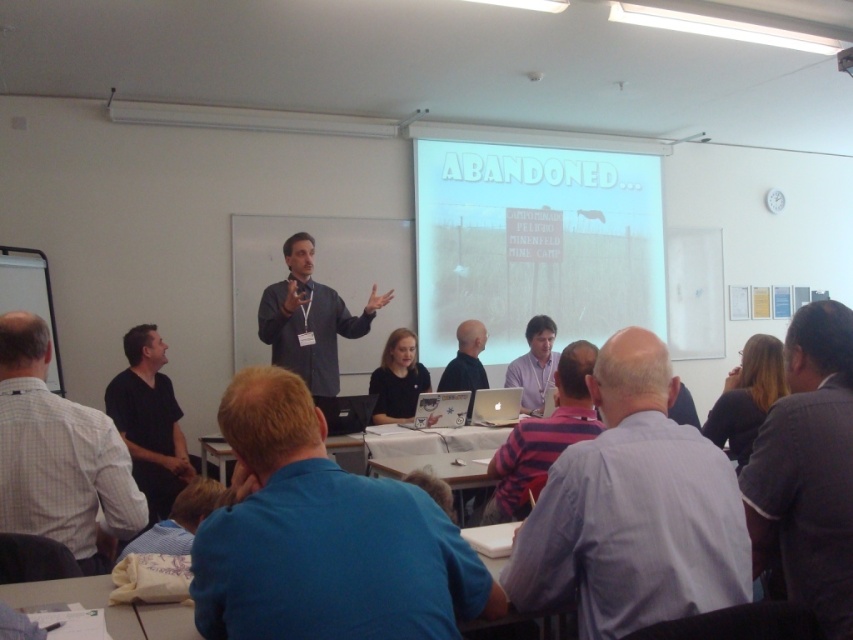
Is gray striped shirt at center to the right of dark gray suit at right from the viewer's perspective?

In fact, gray striped shirt at center is to the left of dark gray suit at right.

Does gray striped shirt at center come behind dark gray suit at right?

That is False.

You are a GUI agent. You are given a task and a screenshot of the screen. Output one action in this format:
    pyautogui.click(x=<x>, y=<y>)
    Task: Click on the gray striped shirt at center
    The width and height of the screenshot is (853, 640).
    Given the screenshot: What is the action you would take?
    pyautogui.click(x=633, y=509)

Between point (567, 387) and point (532, 618), which one is positioned in front?

Positioned in front is point (532, 618).

Between point (567, 364) and point (492, 561), which one is positioned behind?

Positioned behind is point (567, 364).

In order to click on striped fabric shirt at center in this screenshot , I will do `click(543, 436)`.

Is striped fabric shirt at center to the left of black matte shirt at center from the viewer's perspective?

No, striped fabric shirt at center is not to the left of black matte shirt at center.

Consider the image. Does striped fabric shirt at center appear on the right side of black matte shirt at center?

Yes, striped fabric shirt at center is to the right of black matte shirt at center.

The width and height of the screenshot is (853, 640). Identify the location of striped fabric shirt at center. (543, 436).